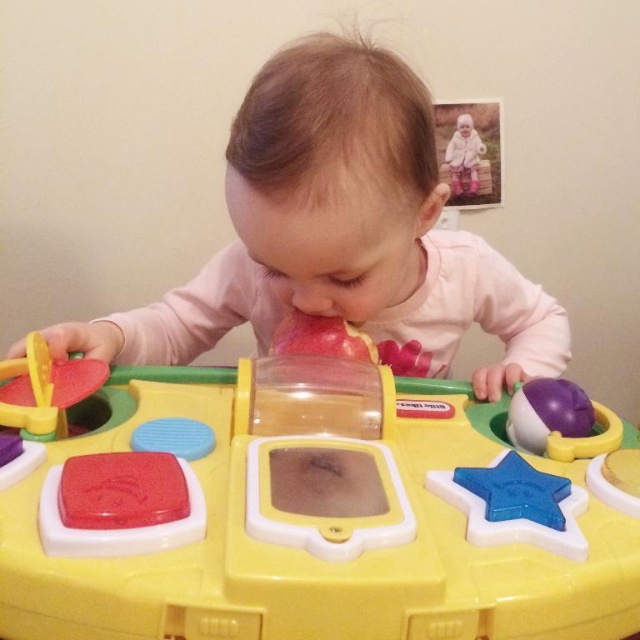
You are a parent observing your child playing with the yellow plastic toy at center and the pink matte toy at center on the toy table. Which toy is taller?

The pink matte toy at center is taller than the yellow plastic toy at center.

You are a parent observing your child playing with the yellow plastic toy at center and the white matte baby at upper right. Which object is closer to your child?

The yellow plastic toy at center is closer to the viewer than the white matte baby at upper right, so the yellow plastic toy at center is closer to the child.